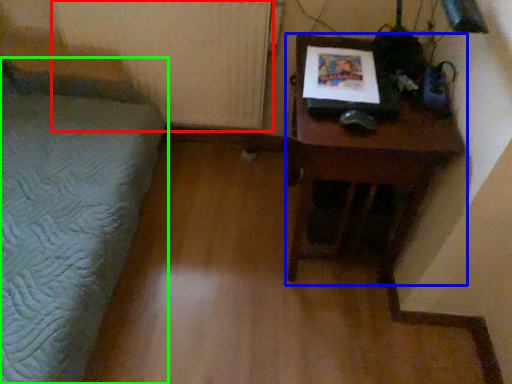
Question: Estimate the real-world distances between objects in this image. Which object is farther from radiator (highlighted by a red box), table (highlighted by a blue box) or furniture (highlighted by a green box)?

Choices:
 (A) table
 (B) furniture

Answer: (A)